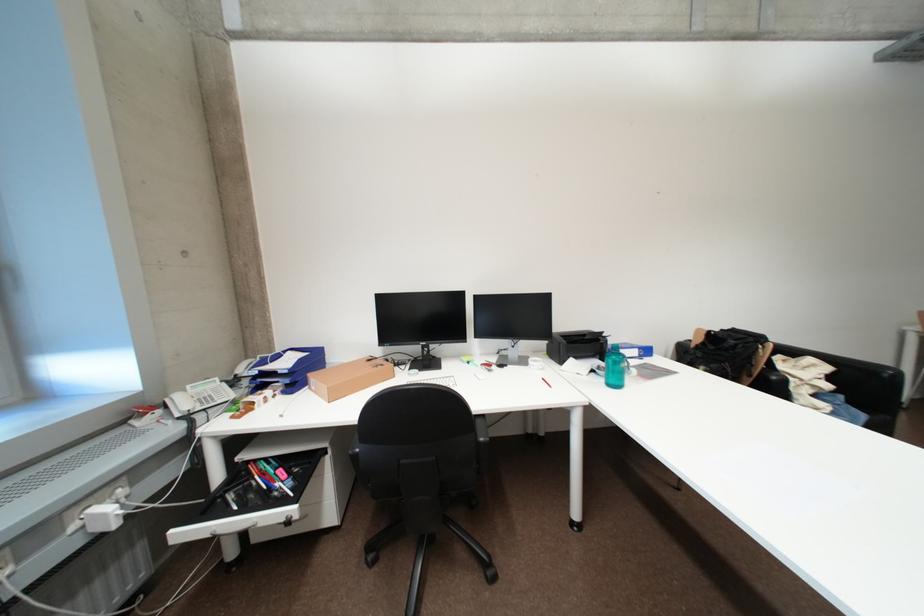
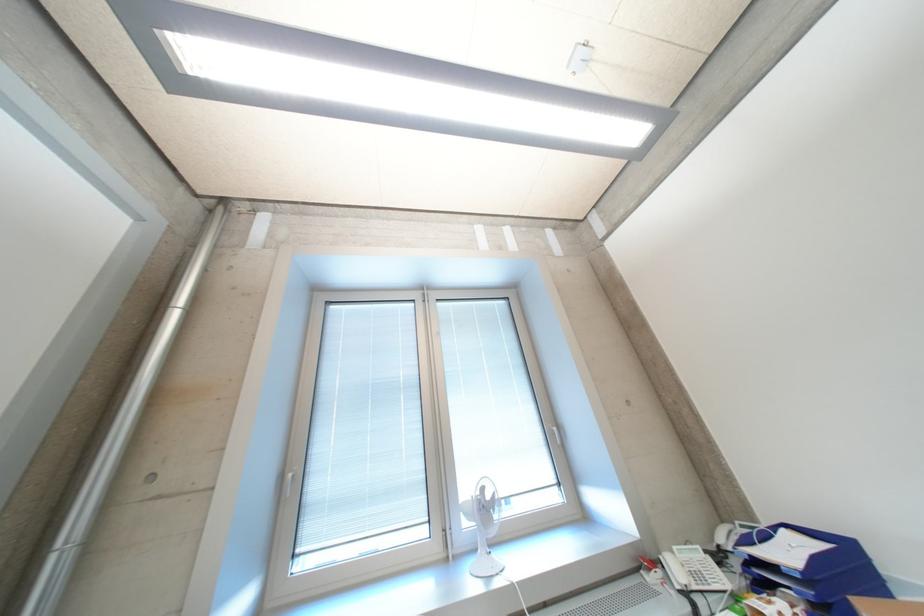
Locate, in the second image, the point that corresponds to (x=195, y=419) in the first image.

(696, 597)